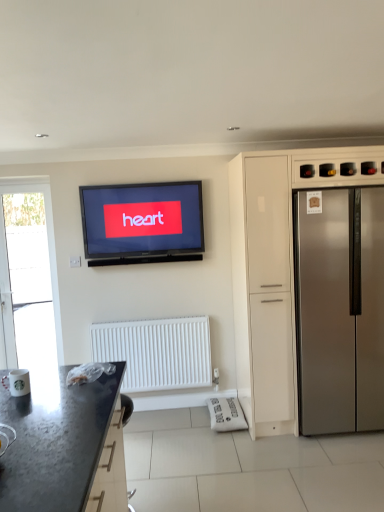
Question: Is point (289, 260) closer or farther from the camera than point (54, 236)?

Choices:
 (A) closer
 (B) farther

Answer: (A)

Question: Which is correct: satin silver refrigerator at right is inside transparent glass door at left, or outside of it?

Choices:
 (A) inside
 (B) outside

Answer: (B)

Question: Estimate the real-world distances between objects in this image. Which object is farther from the stainless steel refrigerator at right?

Choices:
 (A) black granite countertop at lower left
 (B) white matte radiator at lower center
 (C) satin silver refrigerator at right
 (D) transparent glass door at left
 (E) matte black television at upper center

Answer: (D)

Question: Which is nearer to the matte black television at upper center?

Choices:
 (A) white matte radiator at lower center
 (B) black granite countertop at lower left
 (C) transparent glass door at left
 (D) stainless steel refrigerator at right
 (E) satin silver refrigerator at right

Answer: (C)